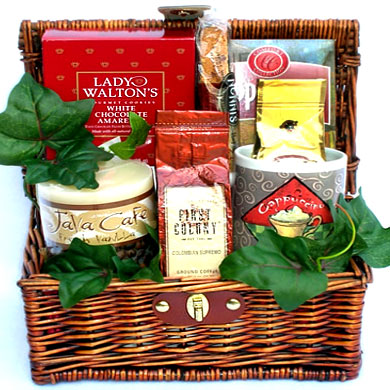
At what (x,y) coordinates should I click in order to perform the action: click on bottom edge of bottom of basket. Please return your answer as a coordinate pair (x, y). Looking at the image, I should click on (124, 379), (179, 379), (255, 378).